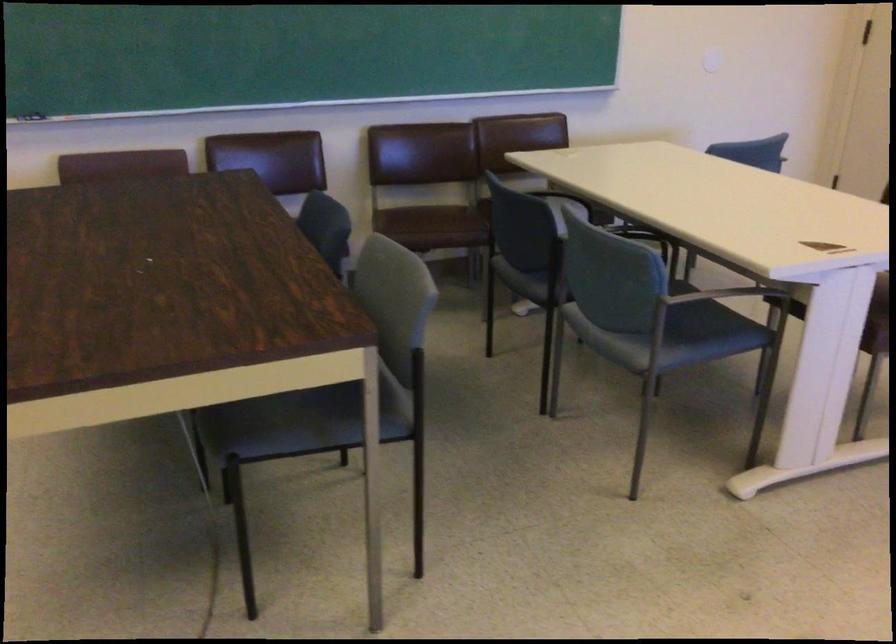
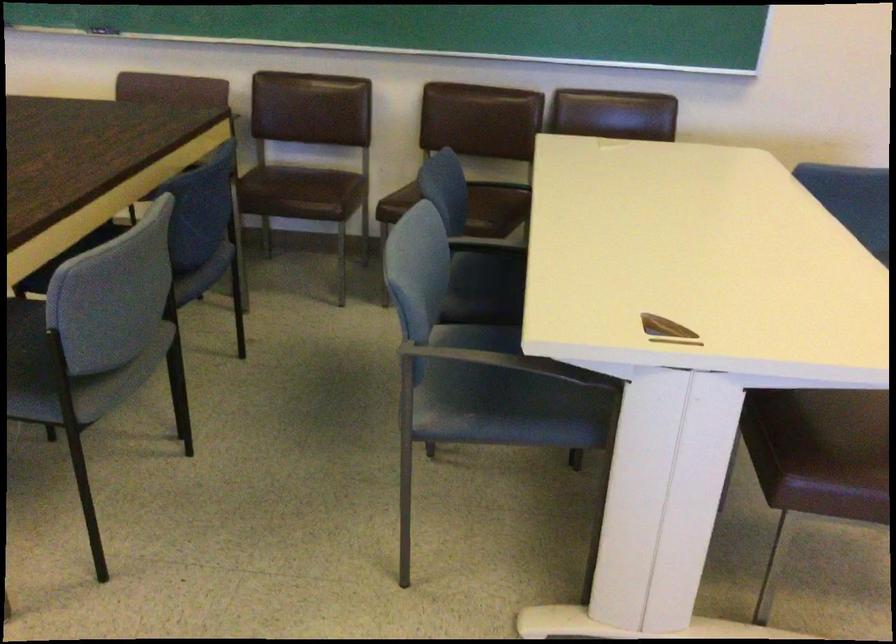
What movement of the cameraman would produce the second image?

The cameraman walked toward right, forward.